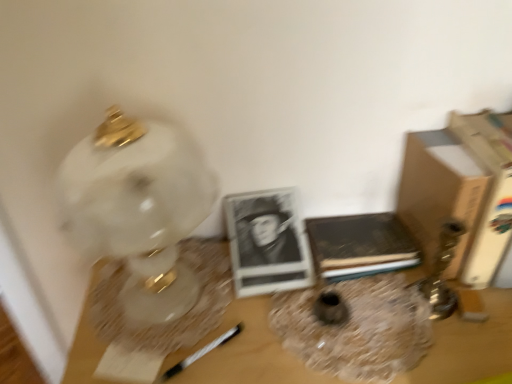
I want to click on vacant space behind matte glass vase at center, which ranks as the 1th vase in left-to-right order, so click(325, 279).